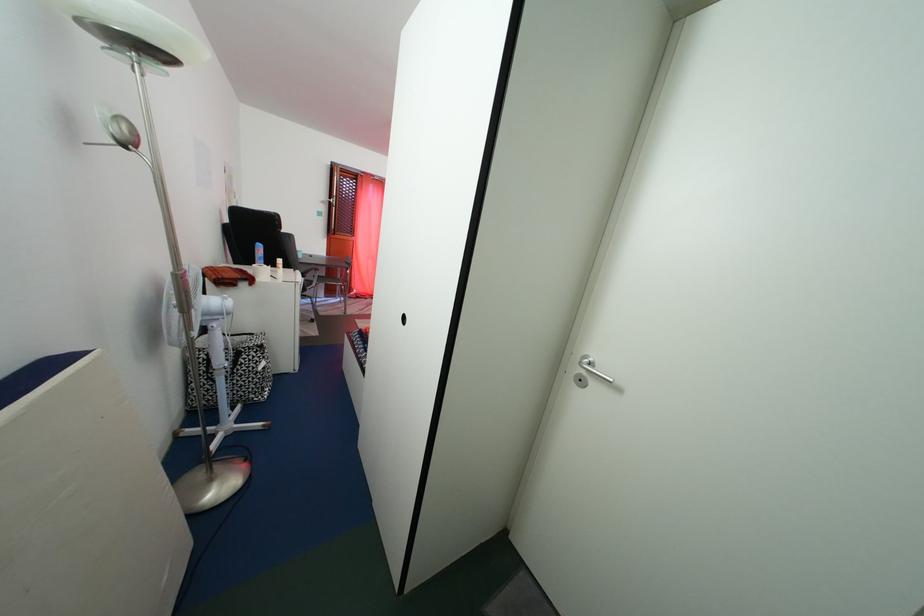
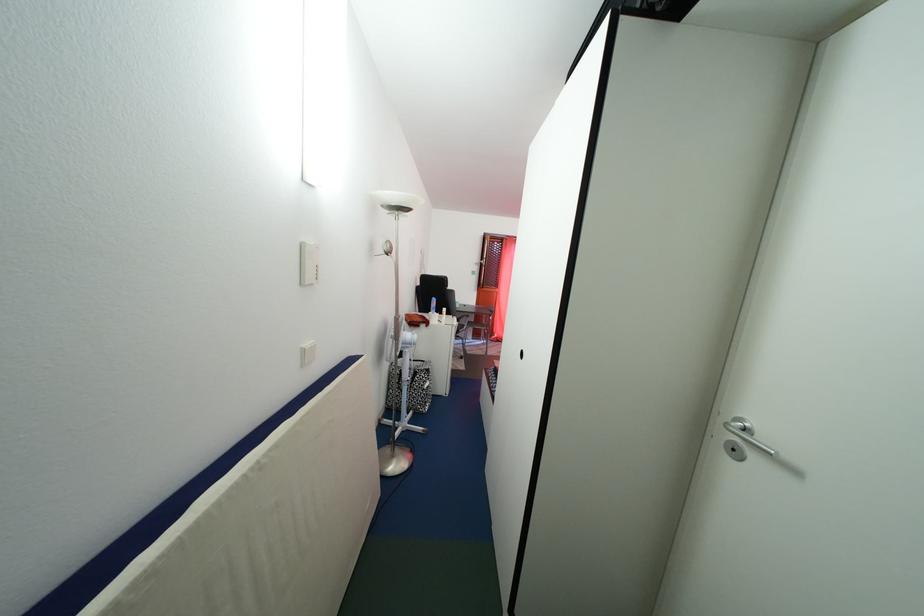
Find the pixel in the second image that matches [75,124] in the first image.

(381, 253)